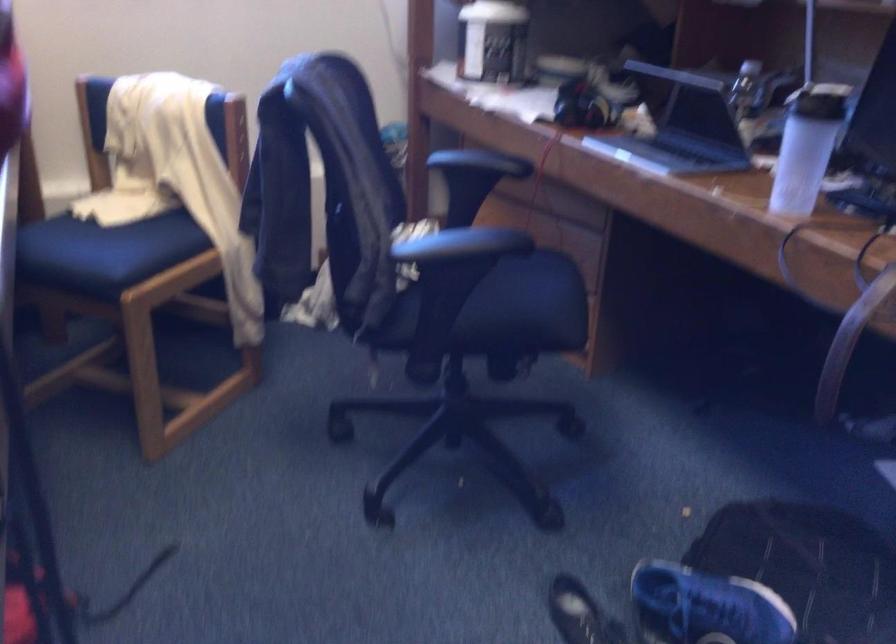
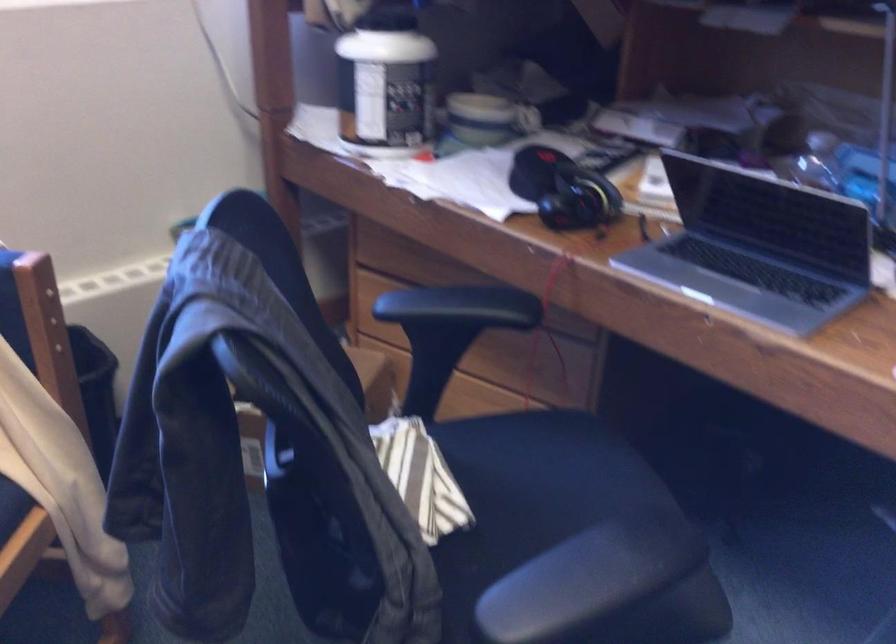
The images are taken continuously from a first-person perspective. In which direction are you moving?

The cameraman walked toward left, forward.